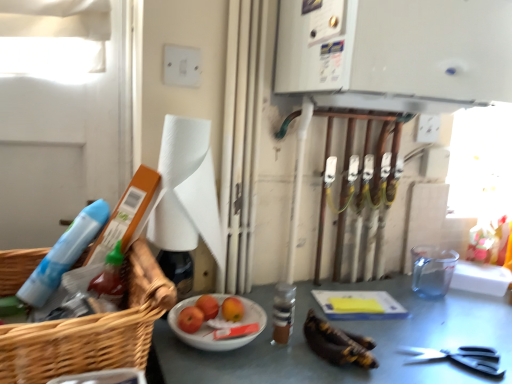
This screenshot has height=384, width=512. I want to click on vacant area that is in front of brown glass bottle at center, so click(297, 360).